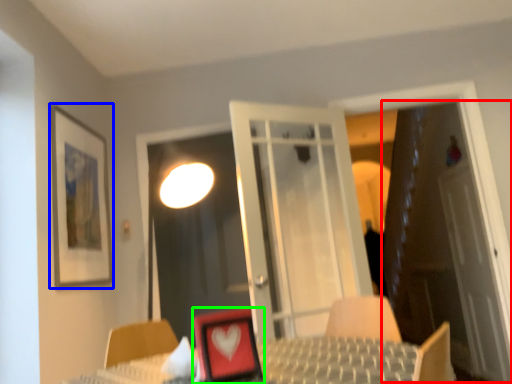
Question: Which object is positioned farthest from door (highlighted by a red box)? Select from picture frame (highlighted by a blue box) and picture frame (highlighted by a green box).

Choices:
 (A) picture frame
 (B) picture frame

Answer: (B)